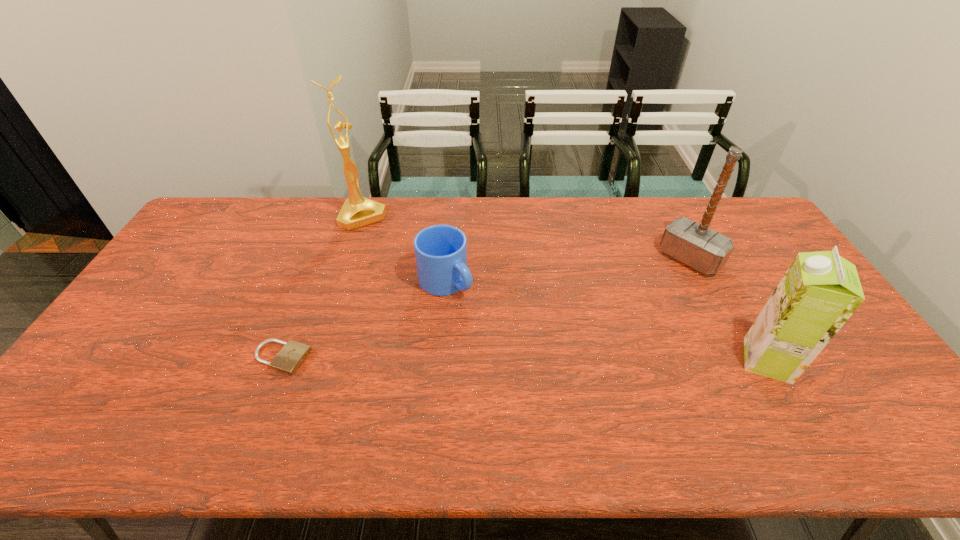
I want to click on free space on the desktop that is between the padlock and the soya milk and is positioned on the front-facing side of the tallest object, so click(468, 359).

The height and width of the screenshot is (540, 960). I want to click on free spot on the desktop that is between the shortest object and the soya milk and is positioned on the striking surface of the hammer, so click(x=580, y=360).

Where is `free spot on the desktop that is between the padlock and the soya milk and is positioned on the side of the mug with the handle`? This screenshot has width=960, height=540. free spot on the desktop that is between the padlock and the soya milk and is positioned on the side of the mug with the handle is located at coordinates (540, 359).